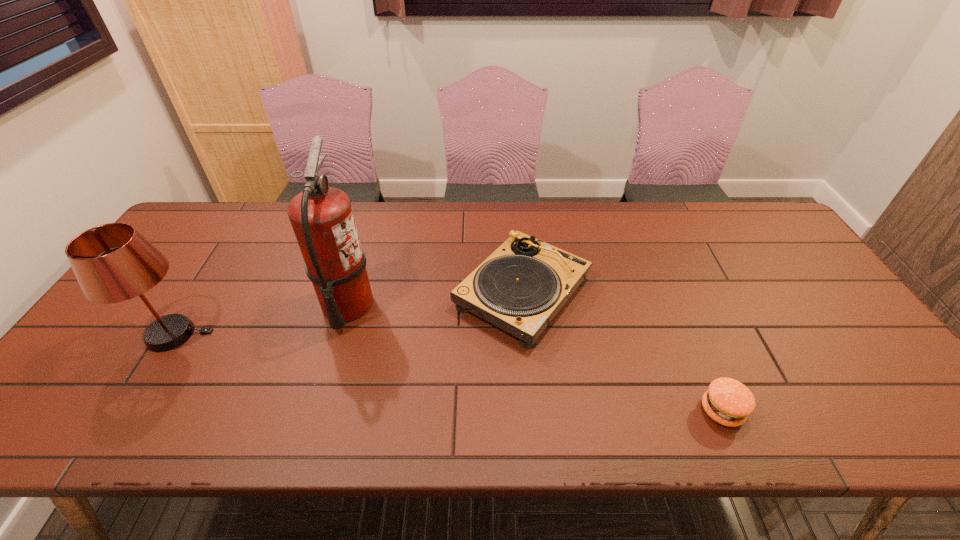
Where is `vacant space that satisfies the following two spatial constraints: 1. toward the nozzle of the shortest object; 2. on the right side of the fire extinguisher`? This screenshot has width=960, height=540. vacant space that satisfies the following two spatial constraints: 1. toward the nozzle of the shortest object; 2. on the right side of the fire extinguisher is located at coordinates (317, 410).

You are a GUI agent. You are given a task and a screenshot of the screen. Output one action in this format:
    pyautogui.click(x=<x>, y=<y>)
    Task: Click on the free space that satisfies the following two spatial constraints: 1. toward the nozzle of the third object from right to left; 2. on the back side of the nearest object
    Image resolution: width=960 pixels, height=540 pixels.
    Given the screenshot: What is the action you would take?
    pyautogui.click(x=317, y=410)

Find the location of a particular element. vacant point that satisfies the following two spatial constraints: 1. on the front-facing side of the third shortest object; 2. on the right side of the nearest object is located at coordinates (126, 410).

The width and height of the screenshot is (960, 540). What are the coordinates of `free space that satisfies the following two spatial constraints: 1. toward the nozzle of the third object from right to left; 2. on the back side of the nearest object` in the screenshot? It's located at (317, 410).

At what (x,y) coordinates should I click in order to perform the action: click on free space that satisfies the following two spatial constraints: 1. on the front-facing side of the leftmost object; 2. on the left side of the shortest object. Please return your answer as a coordinate pair (x, y). The height and width of the screenshot is (540, 960). Looking at the image, I should click on (126, 410).

Where is `vacant space that satisfies the following two spatial constraints: 1. on the front-facing side of the lampshade; 2. on the back side of the shortest object`? vacant space that satisfies the following two spatial constraints: 1. on the front-facing side of the lampshade; 2. on the back side of the shortest object is located at coordinates (126, 410).

I want to click on vacant space that satisfies the following two spatial constraints: 1. on the front side of the record player; 2. on the left side of the shortest object, so click(534, 410).

Where is `free spot that satisfies the following two spatial constraints: 1. on the front-facing side of the lampshade; 2. on the left side of the patty`? The image size is (960, 540). free spot that satisfies the following two spatial constraints: 1. on the front-facing side of the lampshade; 2. on the left side of the patty is located at coordinates (126, 410).